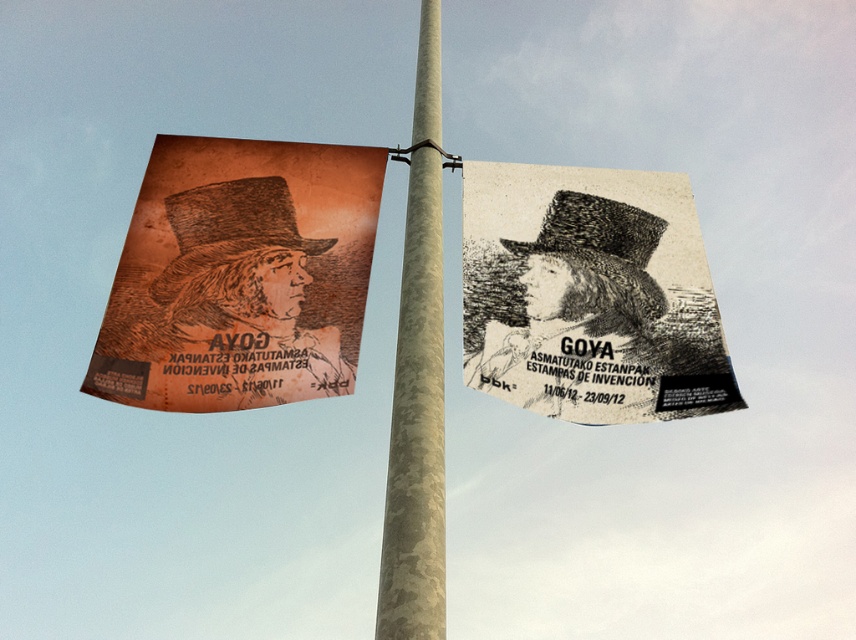
Question: Which object is farther from the camera taking this photo?

Choices:
 (A) black textured paper at upper right
 (B) orange paper poster at left
 (C) camouflage pole at center

Answer: (A)

Question: Is orange paper poster at left below black textured paper at upper right?

Choices:
 (A) no
 (B) yes

Answer: (A)

Question: Among these objects, which one is farthest from the camera?

Choices:
 (A) orange paper poster at left
 (B) camouflage pole at center
 (C) black textured paper at upper right

Answer: (C)

Question: Which of the following is the farthest from the observer?

Choices:
 (A) black textured paper at upper right
 (B) orange paper poster at left
 (C) camouflage pole at center

Answer: (A)

Question: Is black textured paper at upper right to the right of camouflage pole at center from the viewer's perspective?

Choices:
 (A) no
 (B) yes

Answer: (B)

Question: Is orange paper poster at left further to camera compared to camouflage pole at center?

Choices:
 (A) yes
 (B) no

Answer: (A)